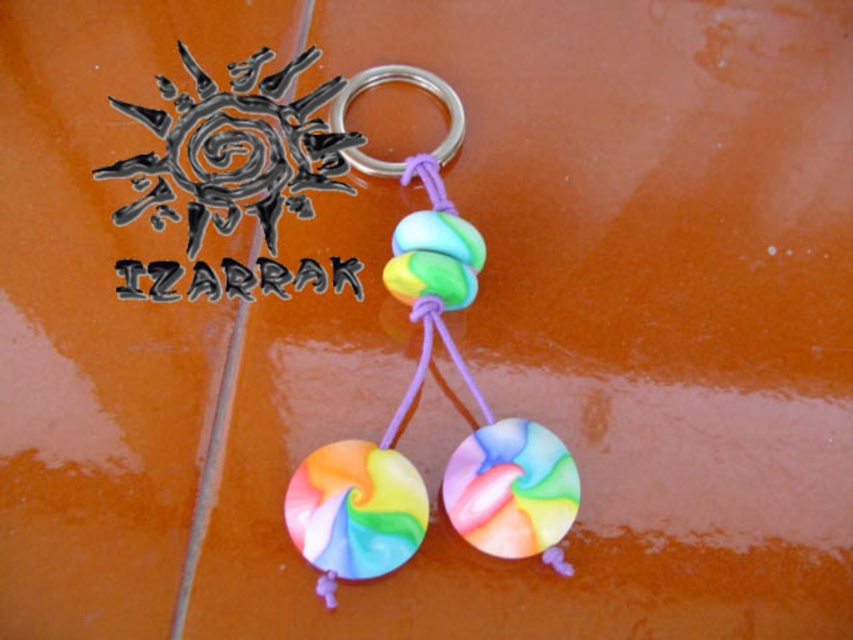
In order to click on rainbow marbled bead at center in this screenshot , I will do `click(511, 488)`.

Does point (502, 508) come in front of point (393, 234)?

That is True.

Does point (573, 461) lie in front of point (418, 212)?

That is True.

Where is `rainbow marbled bead at center`? The image size is (853, 640). rainbow marbled bead at center is located at coordinates (511, 488).

Can you confirm if swirled glass bead at center is wider than rainbow swirl glass bead at center?

No.

Where is `swirled glass bead at center`? This screenshot has width=853, height=640. swirled glass bead at center is located at coordinates (428, 278).

Which is in front, point (402, 260) or point (456, 227)?

Positioned in front is point (402, 260).

At what (x,y) coordinates should I click in order to perform the action: click on swirled glass bead at center. Please return your answer as a coordinate pair (x, y). Looking at the image, I should click on (428, 278).

Can you confirm if matte plastic bead at center is positioned to the right of swirled glass bead at center?

No, matte plastic bead at center is not to the right of swirled glass bead at center.

Who is shorter, matte plastic bead at center or swirled glass bead at center?

swirled glass bead at center

Is point (444, 84) farther from viewer compared to point (460, 282)?

Yes, point (444, 84) is farther from viewer.

Image resolution: width=853 pixels, height=640 pixels. I want to click on matte plastic bead at center, so click(410, 84).